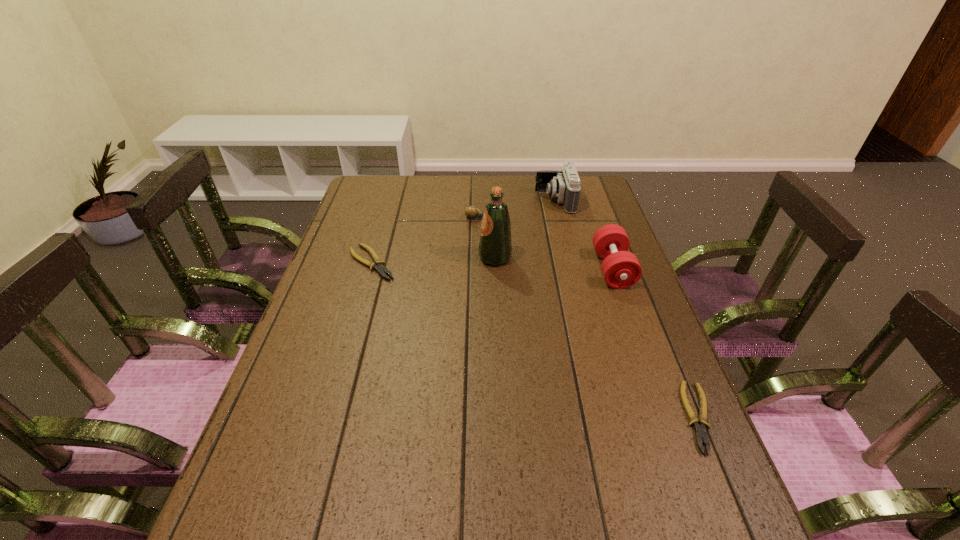
The width and height of the screenshot is (960, 540). In order to click on object that is at the near edge in this screenshot , I will do `click(700, 430)`.

At what (x,y) coordinates should I click in order to perform the action: click on object that is at the left edge. Please return your answer as a coordinate pair (x, y). This screenshot has height=540, width=960. Looking at the image, I should click on (378, 265).

This screenshot has height=540, width=960. In order to click on pliers located at the right edge in this screenshot , I will do `click(700, 430)`.

Locate an element on the screen. camera located at the right edge is located at coordinates (564, 185).

In order to click on dumbbell at the right edge in this screenshot , I will do `click(621, 269)`.

Identify the location of object positioned at the far right corner. (564, 185).

Locate an element on the screen. This screenshot has width=960, height=540. object that is at the near right corner is located at coordinates (700, 430).

In the image, there is a desktop. Where is `vacant space at the far edge`? The image size is (960, 540). vacant space at the far edge is located at coordinates (424, 184).

Locate an element on the screen. The image size is (960, 540). vacant space at the near edge of the desktop is located at coordinates (609, 467).

Identify the location of free space at the left edge. This screenshot has width=960, height=540. (353, 236).